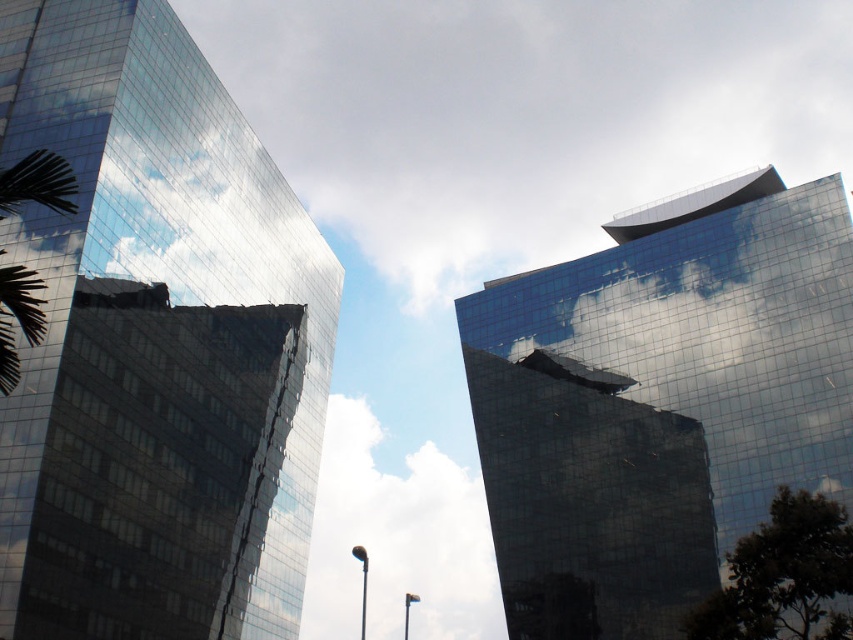
Who is higher up, shiny glass building at left or green leafy palm tree at left?

green leafy palm tree at left is above.

Who is more forward, (248, 579) or (3, 186)?

Point (3, 186) is in front.

Where is `shiny glass building at left`? This screenshot has width=853, height=640. shiny glass building at left is located at coordinates (155, 342).

The height and width of the screenshot is (640, 853). Identify the location of shiny glass building at left. (155, 342).

This screenshot has height=640, width=853. Describe the element at coordinates (155, 342) in the screenshot. I see `shiny glass building at left` at that location.

At what (x,y) coordinates should I click in order to perform the action: click on shiny glass building at left. Please return your answer as a coordinate pair (x, y). Looking at the image, I should click on (155, 342).

Is point (701, 579) closer to viewer compared to point (70, 195)?

No, (701, 579) is behind (70, 195).

Between shiny glass building at upper right and green leafy palm tree at left, which one has more height?

shiny glass building at upper right

Identify the location of shiny glass building at upper right. The image size is (853, 640). (660, 401).